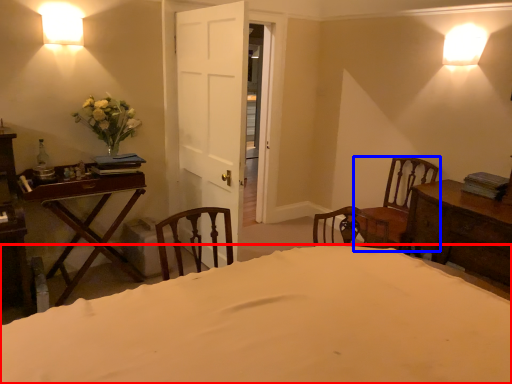
Question: Among these objects, which one is farthest to the camera, bed (highlighted by a red box) or chair (highlighted by a blue box)?

Choices:
 (A) bed
 (B) chair

Answer: (B)